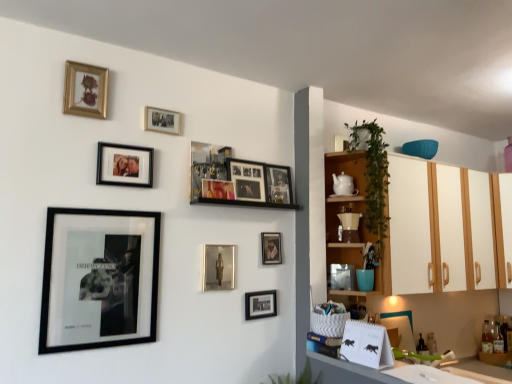
Question: In the image, is green leafy plant at lower center, marked as the first plant in a left-to-right arrangement, on the left side or the right side of gold-framed photo at upper center, the 8th picture frame in the right-to-left sequence?

Choices:
 (A) right
 (B) left

Answer: (A)

Question: Looking at their shapes, would you say green leafy plant at lower center, the 2th plant from the top, is wider or thinner than gold-framed photo at upper center, the 8th picture frame in the right-to-left sequence?

Choices:
 (A) thin
 (B) wide

Answer: (B)

Question: Considering the real-world distances, which object is farthest from the wooden shelves at right?

Choices:
 (A) matte black photo frame at upper center, the 9th picture frame viewed from the right
 (B) gold-framed picture at upper left, placed as the 1th picture frame when sorted from left to right
 (C) metallic/reflective picture frame at upper center, placed as the 5th picture frame when sorted from left to right
 (D) matte black picture frame at center, which is the 10th picture frame in left-to-right order
 (E) green leafy plant at upper right, placed as the first plant when sorted from right to left

Answer: (B)

Question: Based on their relative distances, which object is farther from the matte black photo frame at upper center, the 3th picture frame viewed from the left?

Choices:
 (A) metallic silver picture frame at upper center, the 1th picture frame positioned from the right
 (B) metallic silver photo frame at upper center, the sixth picture frame when ordered from right to left
 (C) metallic/reflective picture frame at upper center, placed as the 5th picture frame when sorted from left to right
 (D) wooden shelves at right
 (E) matte black picture frame at lower center, which appears as the 9th picture frame when viewed from the left

Answer: (D)